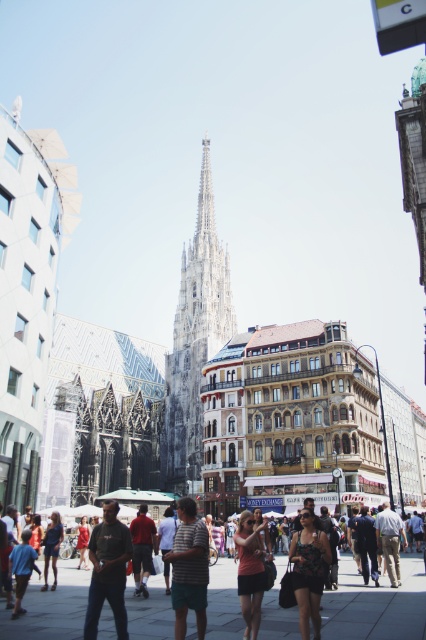
Does point (180, 410) come farther from viewer compared to point (17, 596)?

Yes, it is behind point (17, 596).

Is stone spire at center positioned before blue shirt at lower left?

No, stone spire at center is behind blue shirt at lower left.

Which is in front, point (193, 449) or point (28, 577)?

Point (28, 577)

Where is `stone spire at center`? stone spire at center is located at coordinates (195, 340).

Between stone spire at center and dark blue jeans at center, which one is positioned higher?

stone spire at center is above.

Does stone spire at center have a greater width compared to dark blue jeans at center?

Yes.

Image resolution: width=426 pixels, height=640 pixels. I want to click on stone spire at center, so click(x=195, y=340).

Where is `stone spire at center`? The width and height of the screenshot is (426, 640). stone spire at center is located at coordinates (195, 340).

Is blue shirt at lower left closer to camera compared to matte red dress at center?

Yes, it is in front of matte red dress at center.

Find the location of a particular element. This screenshot has height=640, width=426. blue shirt at lower left is located at coordinates (20, 568).